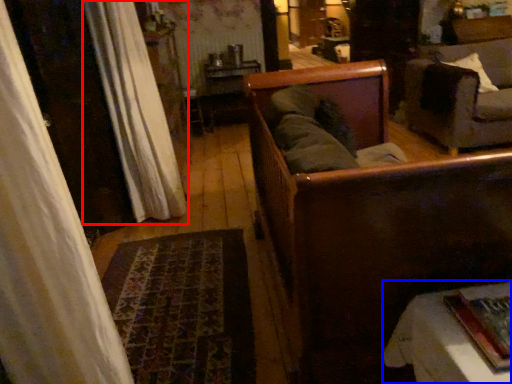
Question: Among these objects, which one is nearest to the camera, curtain (highlighted by a red box) or furniture (highlighted by a blue box)?

Choices:
 (A) curtain
 (B) furniture

Answer: (B)